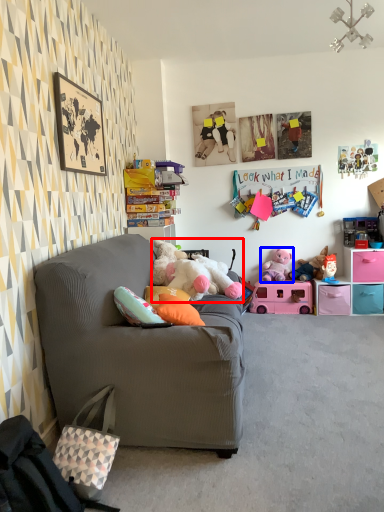
Question: Which point is closer to the camera, toy (highlighted by a red box) or toy (highlighted by a blue box)?

Choices:
 (A) toy
 (B) toy

Answer: (A)